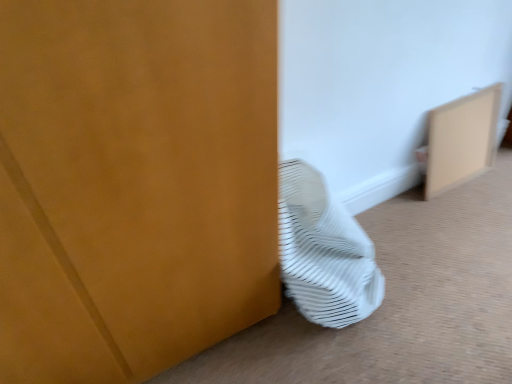
Identify the location of light brown wooden table at right. (461, 140).

This screenshot has width=512, height=384. What do you see at coordinates (461, 140) in the screenshot? I see `light brown wooden table at right` at bounding box center [461, 140].

Where is `light brown wooden table at right`? This screenshot has width=512, height=384. light brown wooden table at right is located at coordinates (461, 140).